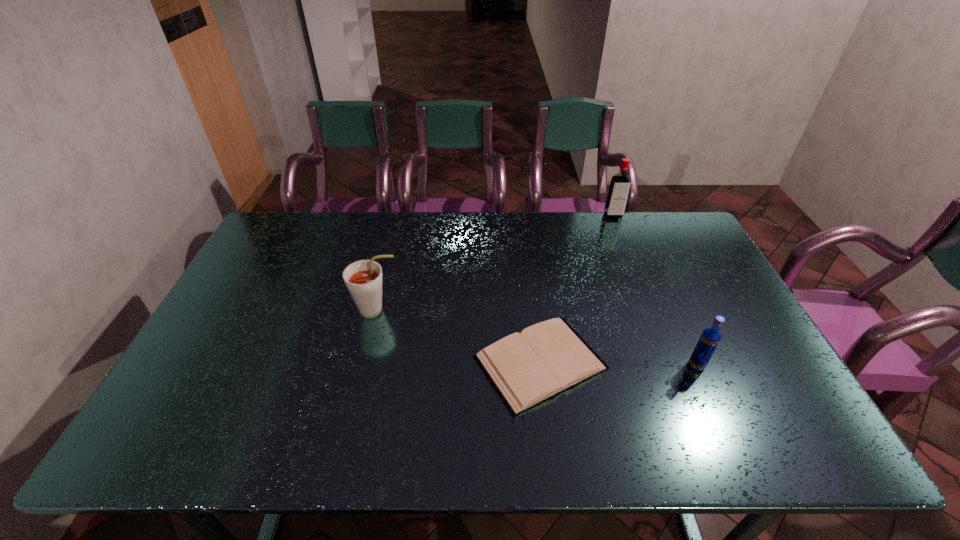
Where is `empty space between the second object from right to left and the root beer`? The height and width of the screenshot is (540, 960). empty space between the second object from right to left and the root beer is located at coordinates (495, 262).

The width and height of the screenshot is (960, 540). I want to click on vacant area that lies between the shortest object and the leftmost object, so click(x=459, y=336).

Where is `vacant point located between the shortest object and the farthest object`? vacant point located between the shortest object and the farthest object is located at coordinates (577, 289).

This screenshot has height=540, width=960. I want to click on free space between the root beer and the farthest object, so click(495, 262).

You are a GUI agent. You are given a task and a screenshot of the screen. Output one action in this format:
    pyautogui.click(x=<x>, y=<y>)
    Task: Click on the free space between the shortest object and the farther vodka
    The image size is (960, 540).
    Given the screenshot: What is the action you would take?
    pos(577,289)

Locate an element on the screen. free point between the left vodka and the hardback book is located at coordinates (577, 289).

Identify which object is the nearest to the hardback book. Please provide its 2D coordinates. Your answer should be formatted as a tuple, i.e. [(x, y)], where the tuple contains the x and y coordinates of a point satisfying the conditions above.

[(710, 337)]

Select which object appears as the closest to the shortest object. Please provide its 2D coordinates. Your answer should be formatted as a tuple, i.e. [(x, y)], where the tuple contains the x and y coordinates of a point satisfying the conditions above.

[(710, 337)]

The image size is (960, 540). I want to click on blank area in the image that satisfies the following two spatial constraints: 1. on the drink side of the leftmost object; 2. on the back side of the hardback book, so pyautogui.click(x=364, y=362).

Where is `vacant space that satisfies the following two spatial constraints: 1. on the drink side of the root beer; 2. on the right side of the hardback book`? The image size is (960, 540). vacant space that satisfies the following two spatial constraints: 1. on the drink side of the root beer; 2. on the right side of the hardback book is located at coordinates (364, 362).